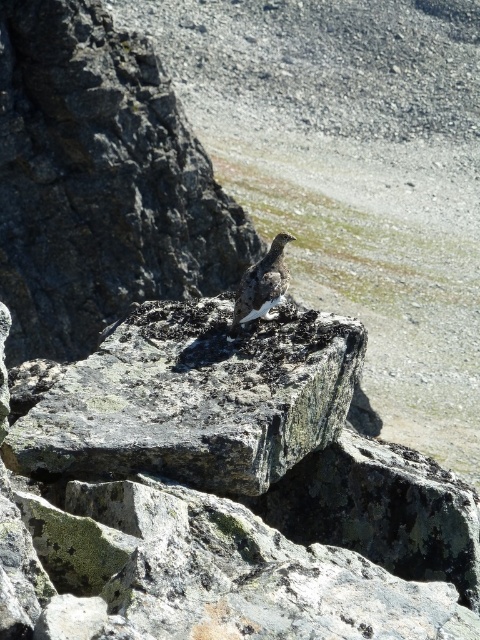
You are a hiker who wants to place a 40 feet long tent between the rough gray rock at center and the white speckled rock at center. Can you fit the tent between them without overlapping the rocks?

The rough gray rock at center and white speckled rock at center are 41.27 feet apart, so yes, the tent can be placed between them since the distance is slightly more than the tent length.

You are a geologist studying rock formations in this landscape. You need to locate the gray rough rock at center for your research. According to the coordinates provided, where exactly would you find it?

The gray rough rock at center is located at point (194, 400).